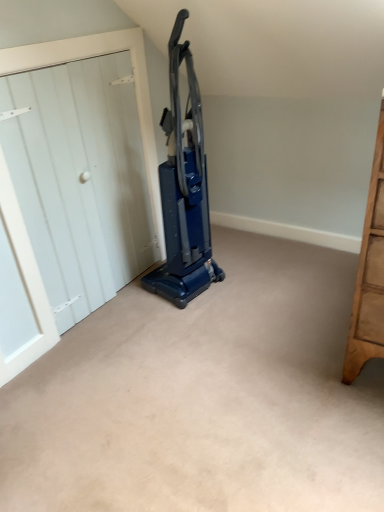
Question: Does blue plastic vacuum cleaner at center have a greater width compared to white wood door at left?

Choices:
 (A) yes
 (B) no

Answer: (A)

Question: Does blue plastic vacuum cleaner at center have a lesser width compared to white wood door at left?

Choices:
 (A) no
 (B) yes

Answer: (A)

Question: From a real-world perspective, is blue plastic vacuum cleaner at center physically below white wood door at left?

Choices:
 (A) no
 (B) yes

Answer: (A)

Question: From the image's perspective, is blue plastic vacuum cleaner at center on top of white wood door at left?

Choices:
 (A) no
 (B) yes

Answer: (B)

Question: Does blue plastic vacuum cleaner at center turn towards white wood door at left?

Choices:
 (A) yes
 (B) no

Answer: (B)

Question: Is blue plastic vacuum cleaner at center next to white wood door at left?

Choices:
 (A) yes
 (B) no

Answer: (B)

Question: From the image's perspective, would you say white wood door at left is positioned over blue plastic vacuum cleaner at center?

Choices:
 (A) no
 (B) yes

Answer: (A)

Question: Is white wood door at left smaller than blue plastic vacuum cleaner at center?

Choices:
 (A) no
 (B) yes

Answer: (B)

Question: Would you say white wood door at left contains blue plastic vacuum cleaner at center?

Choices:
 (A) yes
 (B) no

Answer: (B)

Question: Considering the relative positions of white wood door at left and blue plastic vacuum cleaner at center in the image provided, is white wood door at left to the left of blue plastic vacuum cleaner at center from the viewer's perspective?

Choices:
 (A) yes
 (B) no

Answer: (A)

Question: Does white wood door at left have a lesser width compared to blue plastic vacuum cleaner at center?

Choices:
 (A) no
 (B) yes

Answer: (B)

Question: From a real-world perspective, is white wood door at left physically above blue plastic vacuum cleaner at center?

Choices:
 (A) no
 (B) yes

Answer: (A)

Question: Is blue plastic vacuum cleaner at center in front of or behind white wood door at left in the image?

Choices:
 (A) front
 (B) behind

Answer: (B)